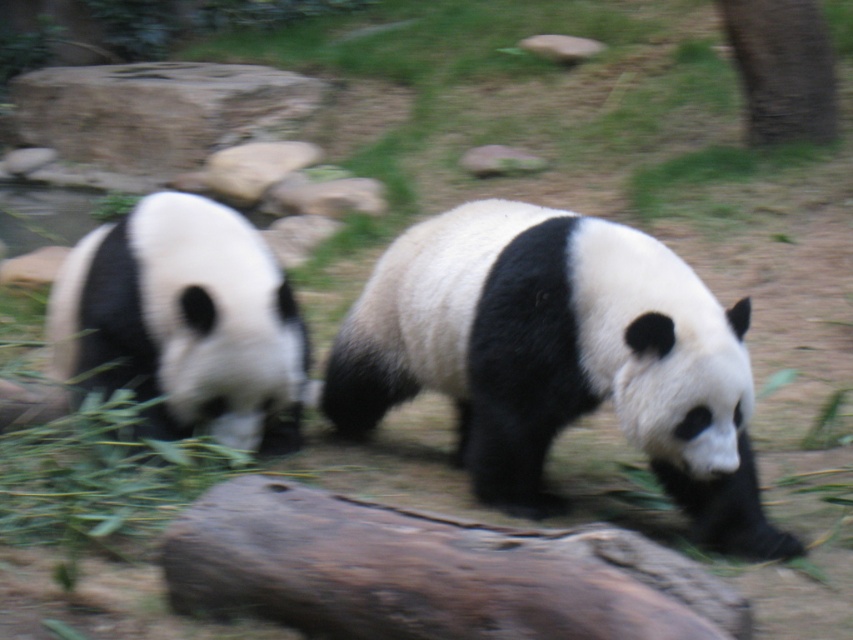
You are a zookeeper observing the pandas and need to place a new feeding tray on the ground. The tray requires a flat surface that is taller than the brown rough log at center. Can the black and white fur panda at left provide a suitable surface for the feeding tray?

The brown rough log at center has a lesser height compared to the black and white fur panda at left, so the panda is taller. Therefore, placing the feeding tray on the black and white fur panda at left would not be suitable since the panda is taller than the required surface height. The log is shorter, so it might be a better option if the tray needs a surface no taller than the log.

You are a zookeeper who needs to move the brown rough log at center and the brown rough tree trunk at upper right to a storage area. Which object should you move first if you want to start with the smaller one?

The brown rough log at center is smaller than the brown rough tree trunk at upper right, so you should move the brown rough log at center first.

You are a zookeeper trying to place a new feeding tray for the pandas. The tray requires a space wider than the brown rough log at center. Can the black and white fur panda at left fit in the space where the log is?

The brown rough log at center is wider than the black and white fur panda at left, so the space where the log is may not be suitable for the feeding tray since it requires a wider space than the log provides. However, the panda itself could fit in that space as the log is wider than the panda.